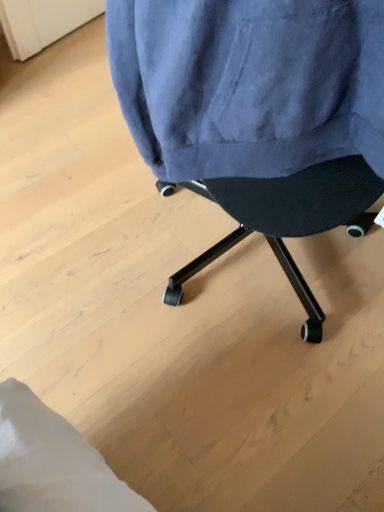
The height and width of the screenshot is (512, 384). I want to click on suede-like blue chair at center, so click(258, 114).

Describe the element at coordinates (258, 114) in the screenshot. The image size is (384, 512). I see `suede-like blue chair at center` at that location.

Identify the location of suede-like blue chair at center. This screenshot has width=384, height=512. (258, 114).